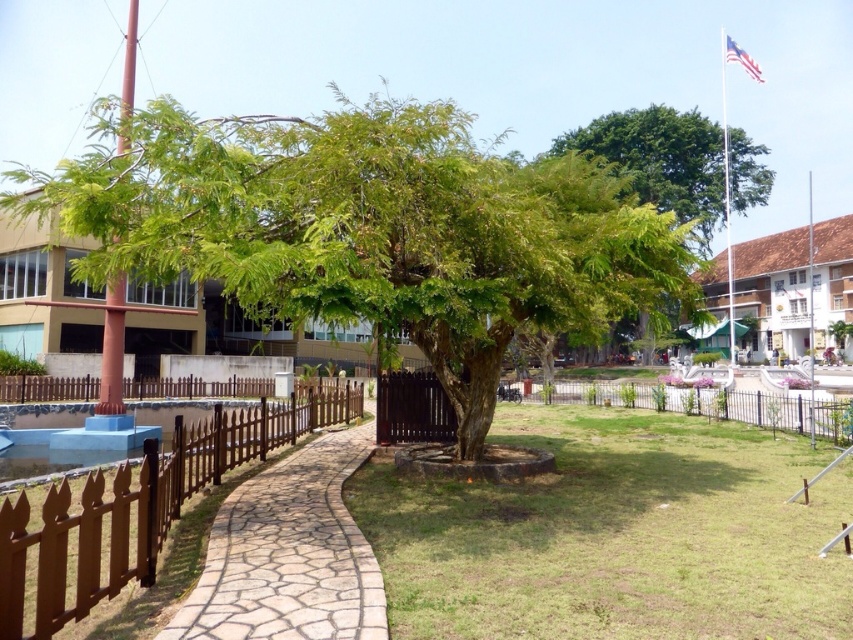
Can you confirm if brown stone pathway at center is shorter than brown wooden fence at left?

Indeed, brown stone pathway at center has a lesser height compared to brown wooden fence at left.

Which is in front, point (309, 588) or point (44, 589)?

Point (44, 589) is in front.

This screenshot has height=640, width=853. Describe the element at coordinates (289, 554) in the screenshot. I see `brown stone pathway at center` at that location.

The width and height of the screenshot is (853, 640). Identify the location of brown stone pathway at center. (289, 554).

Who is higher up, white painted wood hotel at right or polished metal flag pole at upper right?

polished metal flag pole at upper right is above.

Is point (759, 301) farther from camera compared to point (733, 352)?

Yes, it is.

Identify the location of white painted wood hotel at right. Image resolution: width=853 pixels, height=640 pixels. (772, 291).

Is brown stone pathway at center taller than polished metal flag pole at upper right?

No, brown stone pathway at center is not taller than polished metal flag pole at upper right.

Is brown stone pathway at center to the left of polished metal flag pole at upper right from the viewer's perspective?

Correct, you'll find brown stone pathway at center to the left of polished metal flag pole at upper right.

Is point (381, 616) farther from viewer compared to point (727, 252)?

No, it is not.

Locate an element on the screen. This screenshot has width=853, height=640. brown stone pathway at center is located at coordinates (289, 554).